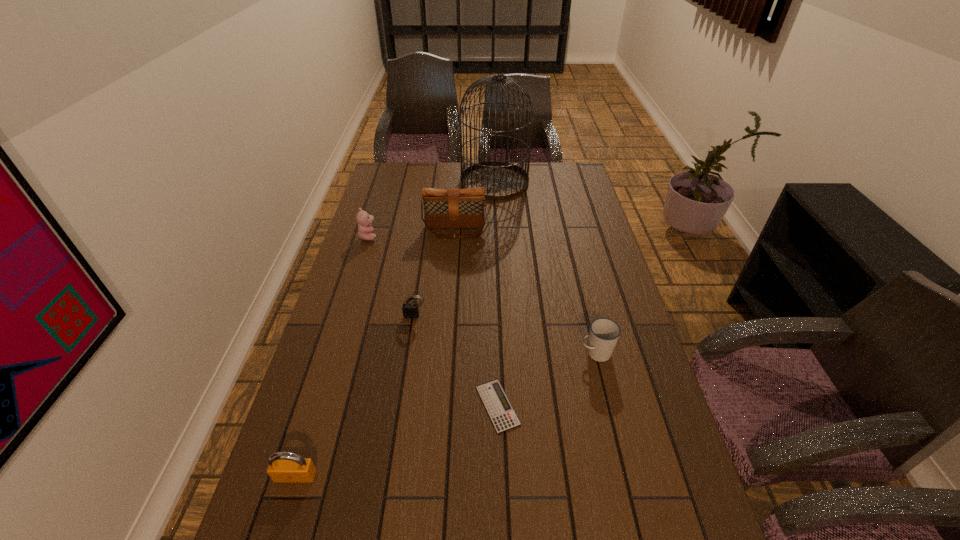
Find the location of a particular element. the tallest object is located at coordinates (501, 180).

I want to click on the farthest object, so click(x=501, y=180).

Locate an element on the screen. The width and height of the screenshot is (960, 540). the sixth shortest object is located at coordinates (443, 208).

Where is `teddy bear`? The width and height of the screenshot is (960, 540). teddy bear is located at coordinates (365, 231).

The image size is (960, 540). What are the coordinates of `the rightmost object` in the screenshot? It's located at (604, 333).

Locate an element on the screen. the fifth farthest object is located at coordinates (604, 333).

You are a GUI agent. You are given a task and a screenshot of the screen. Output one action in this format:
    pyautogui.click(x=<x>, y=<y>)
    Task: Click on the taller padlock
    
    Given the screenshot: What is the action you would take?
    pyautogui.click(x=284, y=467)

Image resolution: width=960 pixels, height=540 pixels. Find the location of `the left padlock`. the left padlock is located at coordinates (284, 467).

At what (x,y) coordinates should I click in order to perform the action: click on the farther padlock. Please return your answer as a coordinate pair (x, y). The width and height of the screenshot is (960, 540). Looking at the image, I should click on (410, 310).

Where is `the fourth nearest object`? Image resolution: width=960 pixels, height=540 pixels. the fourth nearest object is located at coordinates (410, 310).